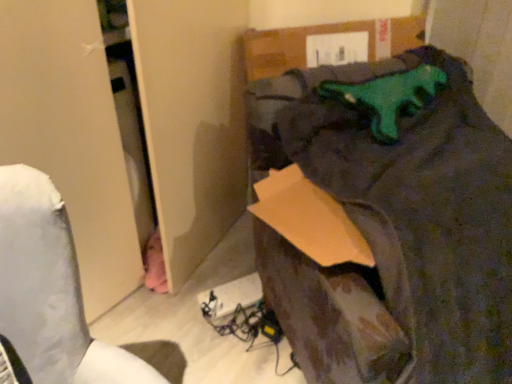
What do you see at coordinates (392, 221) in the screenshot?
I see `dark fabric bag at upper right` at bounding box center [392, 221].

Image resolution: width=512 pixels, height=384 pixels. What are the coordinates of `dark fabric bag at upper right` in the screenshot? It's located at (392, 221).

Find the location of a particular element. This screenshot has height=384, width=512. dark fabric bag at upper right is located at coordinates (392, 221).